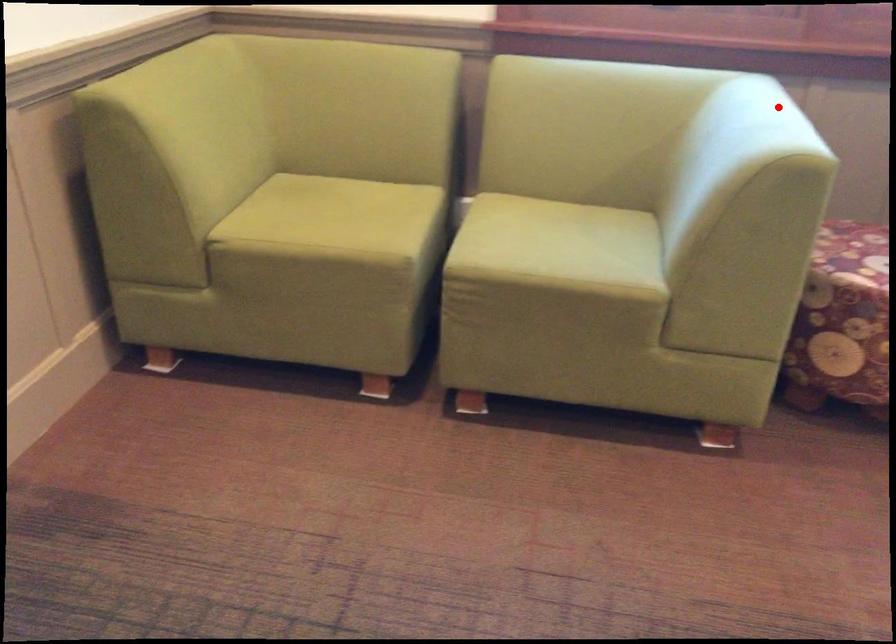
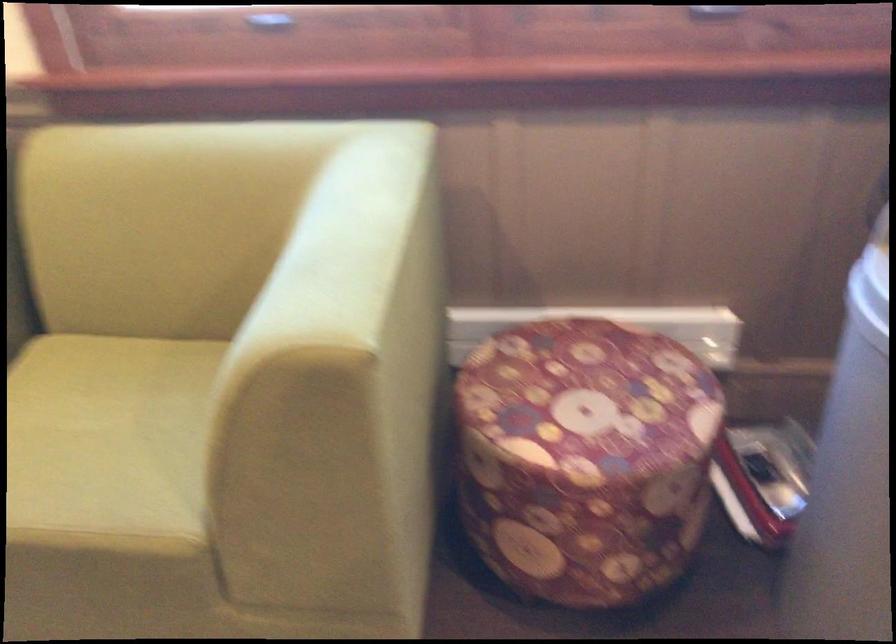
Find the pixel in the second image that matches the highlighted location in the first image.

(358, 223)